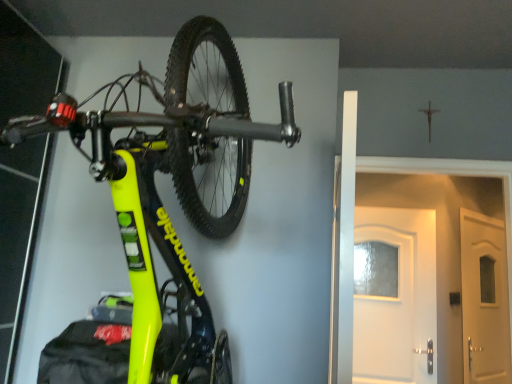
The width and height of the screenshot is (512, 384). What do you see at coordinates (453, 175) in the screenshot? I see `white matte door at center` at bounding box center [453, 175].

The image size is (512, 384). What are the coordinates of `white matte door at center` in the screenshot? It's located at (453, 175).

Identify the location of neon yellow matte bicycle at upper left. Image resolution: width=512 pixels, height=384 pixels. (174, 183).

Measure the distance between point (136, 341) and camera.

A distance of 37.64 inches exists between point (136, 341) and camera.

What do you see at coordinates (174, 183) in the screenshot? The height and width of the screenshot is (384, 512). I see `neon yellow matte bicycle at upper left` at bounding box center [174, 183].

This screenshot has width=512, height=384. What are the coordinates of `white matte door at center` in the screenshot? It's located at (453, 175).

Considering the relative positions of white matte door at center and neon yellow matte bicycle at upper left in the image provided, is white matte door at center to the left or to the right of neon yellow matte bicycle at upper left?

Based on their positions, white matte door at center is located to the right of neon yellow matte bicycle at upper left.

Consider the image. Considering the relative positions of white matte door at center and neon yellow matte bicycle at upper left in the image provided, is white matte door at center behind neon yellow matte bicycle at upper left?

Yes, white matte door at center is further from the viewer.

Does point (496, 169) lie in front of point (123, 194)?

No.

From the image's perspective, who appears lower, white matte door at center or neon yellow matte bicycle at upper left?

white matte door at center is shown below in the image.

From a real-world perspective, does white matte door at center stand above neon yellow matte bicycle at upper left?

Actually, white matte door at center is physically below neon yellow matte bicycle at upper left in the real world.

Looking at their sizes, would you say white matte door at center is wider or thinner than neon yellow matte bicycle at upper left?

Considering their sizes, white matte door at center looks slimmer than neon yellow matte bicycle at upper left.

Is white matte door at center taller than neon yellow matte bicycle at upper left?

Incorrect, the height of white matte door at center is not larger of that of neon yellow matte bicycle at upper left.

Which of these two, white matte door at center or neon yellow matte bicycle at upper left, is smaller?

white matte door at center is smaller.

Is white matte door at center not inside neon yellow matte bicycle at upper left?

Yes, white matte door at center is outside of neon yellow matte bicycle at upper left.

Is white matte door at center positioned far away from neon yellow matte bicycle at upper left?

No.

Is white matte door at center positioned with its back to neon yellow matte bicycle at upper left?

No, white matte door at center is not facing the opposite direction of neon yellow matte bicycle at upper left.

How distant is white matte door at center from neon yellow matte bicycle at upper left?

white matte door at center is 79.38 centimeters from neon yellow matte bicycle at upper left.

Identify the location of door that appears below the neon yellow matte bicycle at upper left (from a real-world perspective). (453, 175).

Considering the positions of objects neon yellow matte bicycle at upper left and white matte door at center in the image provided, who is more to the right, neon yellow matte bicycle at upper left or white matte door at center?

white matte door at center is more to the right.

Which is behind, neon yellow matte bicycle at upper left or white matte door at center?

Positioned behind is white matte door at center.

Does point (150, 286) appear closer or farther from the camera than point (395, 157)?

Point (150, 286) is closer to the camera than point (395, 157).

Consider the image. From the image's perspective, is neon yellow matte bicycle at upper left above white matte door at center?

Correct, neon yellow matte bicycle at upper left appears higher than white matte door at center in the image.

Consider the image. From a real-world perspective, is neon yellow matte bicycle at upper left physically below white matte door at center?

No, from a real-world perspective, neon yellow matte bicycle at upper left is not under white matte door at center.

Does neon yellow matte bicycle at upper left have a lesser width compared to white matte door at center?

No.

In the scene shown: From their relative heights in the image, would you say neon yellow matte bicycle at upper left is taller or shorter than white matte door at center?

Clearly, neon yellow matte bicycle at upper left is taller compared to white matte door at center.

Can you confirm if neon yellow matte bicycle at upper left is bigger than white matte door at center?

Yes.

Based on the photo, can white matte door at center be found inside neon yellow matte bicycle at upper left?

That's incorrect, white matte door at center is not inside neon yellow matte bicycle at upper left.

Is neon yellow matte bicycle at upper left with white matte door at center?

There is a gap between neon yellow matte bicycle at upper left and white matte door at center.

Does neon yellow matte bicycle at upper left turn towards white matte door at center?

No, neon yellow matte bicycle at upper left is not turned towards white matte door at center.

Find the location of a particular element. The image size is (512, 384). bicycle above the white matte door at center (from a real-world perspective) is located at coordinates (174, 183).

At what (x,y) coordinates should I click in order to perform the action: click on bicycle above the white matte door at center (from a real-world perspective). Please return your answer as a coordinate pair (x, y). The width and height of the screenshot is (512, 384). Looking at the image, I should click on (174, 183).

Find the location of a particular element. The height and width of the screenshot is (384, 512). bicycle above the white matte door at center (from the image's perspective) is located at coordinates (174, 183).